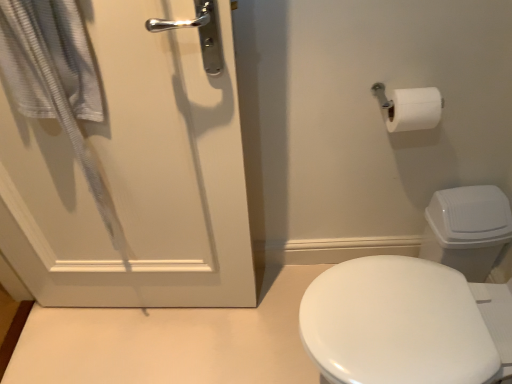
Question: From a real-world perspective, is white plastic toilet bowl at right on white matte door at left?

Choices:
 (A) no
 (B) yes

Answer: (A)

Question: Is white plastic toilet bowl at right further to the viewer compared to white matte door at left?

Choices:
 (A) yes
 (B) no

Answer: (A)

Question: Is white plastic toilet bowl at right to the right of white matte door at left from the viewer's perspective?

Choices:
 (A) no
 (B) yes

Answer: (B)

Question: Is white plastic toilet bowl at right positioned beyond the bounds of white matte door at left?

Choices:
 (A) no
 (B) yes

Answer: (B)

Question: Is white plastic toilet bowl at right bigger than white matte door at left?

Choices:
 (A) no
 (B) yes

Answer: (A)

Question: Is white plastic toilet bowl at right in front of or behind white textured towel at left in the image?

Choices:
 (A) behind
 (B) front

Answer: (A)

Question: Looking at their shapes, would you say white plastic toilet bowl at right is wider or thinner than white textured towel at left?

Choices:
 (A) thin
 (B) wide

Answer: (B)

Question: Considering the positions of point (480, 238) and point (45, 72), is point (480, 238) closer or farther from the camera than point (45, 72)?

Choices:
 (A) closer
 (B) farther

Answer: (B)

Question: From their relative heights in the image, would you say white plastic toilet bowl at right is taller or shorter than white textured towel at left?

Choices:
 (A) tall
 (B) short

Answer: (B)

Question: Which is correct: white plastic toilet bowl at right is inside white matte door at left, or outside of it?

Choices:
 (A) inside
 (B) outside

Answer: (B)

Question: From their relative heights in the image, would you say white plastic toilet bowl at right is taller or shorter than white matte door at left?

Choices:
 (A) tall
 (B) short

Answer: (B)

Question: From a real-world perspective, is white plastic toilet bowl at right positioned above or below white matte door at left?

Choices:
 (A) below
 (B) above

Answer: (A)

Question: From the image's perspective, relative to white matte door at left, is white plastic toilet bowl at right above or below?

Choices:
 (A) below
 (B) above

Answer: (A)

Question: In the image, is white textured towel at left on the left side or the right side of white plastic toilet bowl at right?

Choices:
 (A) right
 (B) left

Answer: (B)

Question: From a real-world perspective, is white textured towel at left above or below white plastic toilet bowl at right?

Choices:
 (A) below
 (B) above

Answer: (B)